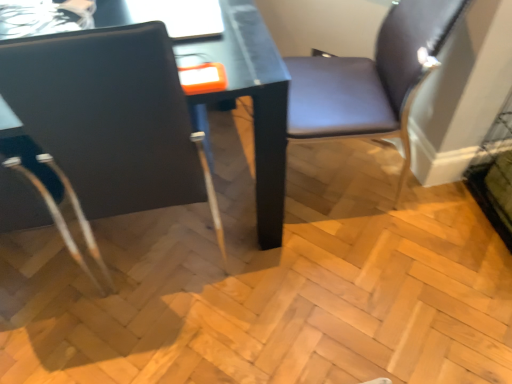
Where is `free location in front of matte black chair at left, arranged as the 2th chair when viewed from the right`? free location in front of matte black chair at left, arranged as the 2th chair when viewed from the right is located at coordinates (163, 338).